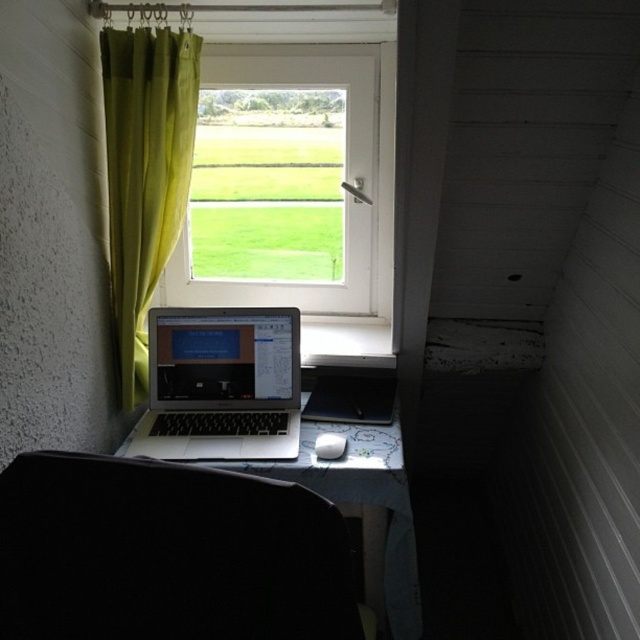
You are a person who is 1.7 meters tall. You want to sit on the black fabric chair at lower center while using the sleek silver laptop at center. Will your knees be able to comfortably fit under the table?

The black fabric chair at lower center is not as tall as the sleek silver laptop at center, so the chair is shorter. This means your knees might not have enough space under the table since the chair is lower, bringing your legs closer to the table surface.

You are standing in the workspace and want to reach both points. Which point, point (163, 624) or point (406, 547), is closer to you?

Point (163, 624) is closer to the viewer than point (406, 547).